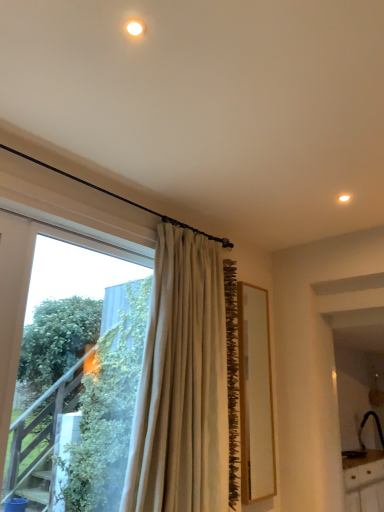
Question: From a real-world perspective, is black matte sink at lower right located higher than beige fabric curtain at center?

Choices:
 (A) no
 (B) yes

Answer: (A)

Question: Is black matte sink at lower right closer to camera compared to beige fabric curtain at center?

Choices:
 (A) no
 (B) yes

Answer: (A)

Question: From a real-world perspective, is black matte sink at lower right below beige fabric curtain at center?

Choices:
 (A) yes
 (B) no

Answer: (A)

Question: Is black matte sink at lower right facing away from beige fabric curtain at center?

Choices:
 (A) no
 (B) yes

Answer: (A)

Question: Is black matte sink at lower right taller than beige fabric curtain at center?

Choices:
 (A) no
 (B) yes

Answer: (A)

Question: Considering the relative positions of black matte sink at lower right and beige fabric curtain at center in the image provided, is black matte sink at lower right behind beige fabric curtain at center?

Choices:
 (A) yes
 (B) no

Answer: (A)

Question: Can you confirm if black matte sink at lower right is thinner than transparent glass window at left?

Choices:
 (A) yes
 (B) no

Answer: (B)

Question: From the image's perspective, is black matte sink at lower right located above transparent glass window at left?

Choices:
 (A) yes
 (B) no

Answer: (B)

Question: From the image's perspective, is black matte sink at lower right below transparent glass window at left?

Choices:
 (A) no
 (B) yes

Answer: (B)

Question: Is transparent glass window at left located within black matte sink at lower right?

Choices:
 (A) yes
 (B) no

Answer: (B)

Question: Considering the relative positions of black matte sink at lower right and transparent glass window at left in the image provided, is black matte sink at lower right behind transparent glass window at left?

Choices:
 (A) no
 (B) yes

Answer: (B)

Question: Does black matte sink at lower right have a greater height compared to transparent glass window at left?

Choices:
 (A) yes
 (B) no

Answer: (B)

Question: Considering the relative positions of beige fabric curtain at center and black matte sink at lower right in the image provided, is beige fabric curtain at center to the left of black matte sink at lower right from the viewer's perspective?

Choices:
 (A) no
 (B) yes

Answer: (B)